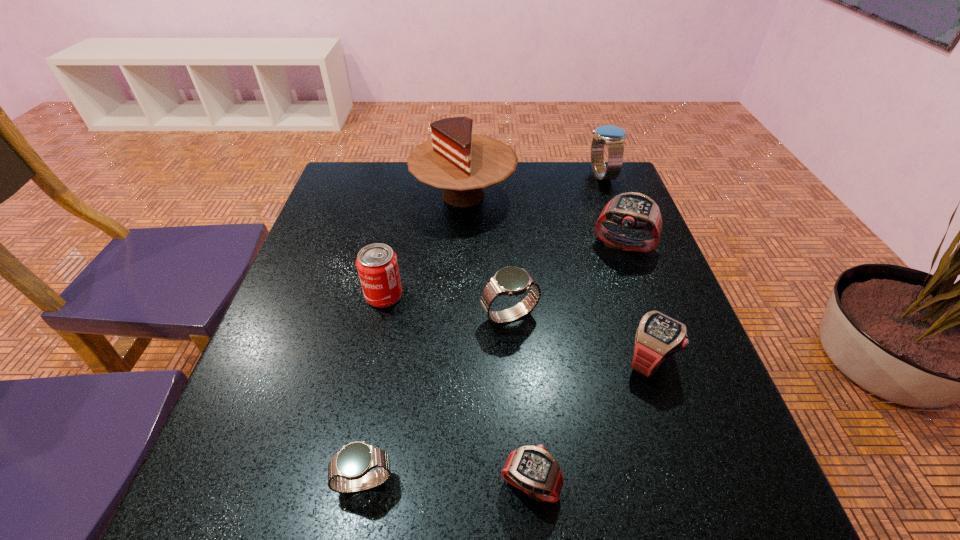
Find the location of `red cake`. red cake is located at coordinates (463, 164).

Identify the location of the tallest object. The width and height of the screenshot is (960, 540). (463, 164).

Where is `the farthest blue watch`? This screenshot has height=540, width=960. the farthest blue watch is located at coordinates (613, 137).

Locate an element on the screen. Image resolution: width=960 pixels, height=540 pixels. the biggest blue watch is located at coordinates (613, 137).

I want to click on the biggest red watch, so click(632, 210).

Find the location of `the second farthest watch`. the second farthest watch is located at coordinates (632, 210).

Image resolution: width=960 pixels, height=540 pixels. What are the coordinates of `red can` in the screenshot? It's located at (377, 265).

The width and height of the screenshot is (960, 540). I want to click on the second biggest blue watch, so click(511, 281).

Identify the location of the second blue watch from right to left. This screenshot has width=960, height=540. (511, 281).

The width and height of the screenshot is (960, 540). I want to click on the sixth farthest object, so click(x=658, y=337).